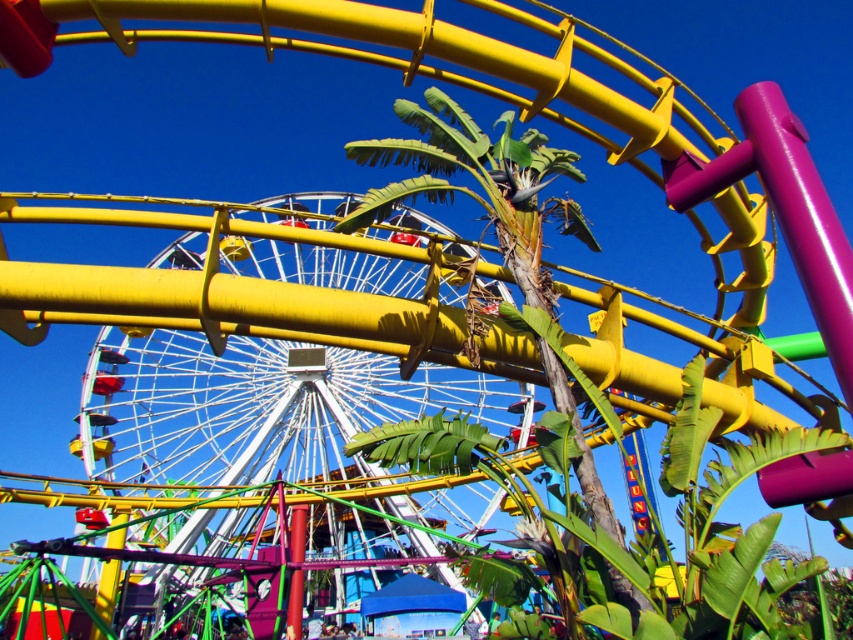
Question: Among these points, which one is nearest to the camera?

Choices:
 (A) (498, 492)
 (B) (450, 186)

Answer: (B)

Question: Is metallic white ferris wheel at center wider than green leafy palm tree at center?

Choices:
 (A) yes
 (B) no

Answer: (A)

Question: Does metallic white ferris wheel at center appear over green leafy palm tree at center?

Choices:
 (A) yes
 (B) no

Answer: (B)

Question: Can you confirm if metallic white ferris wheel at center is thinner than green leafy palm tree at center?

Choices:
 (A) no
 (B) yes

Answer: (A)

Question: Which point appears farthest from the camera in this image?

Choices:
 (A) (543, 301)
 (B) (90, 467)

Answer: (B)